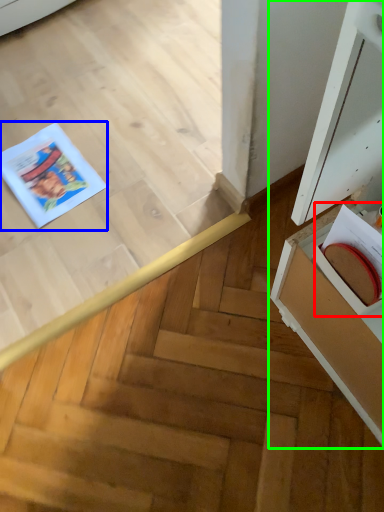
Question: Based on their relative distances, which object is nearer to book (highlighted by a red box)? Choose from comic book (highlighted by a blue box) and cabinetry (highlighted by a green box).

Choices:
 (A) comic book
 (B) cabinetry

Answer: (B)